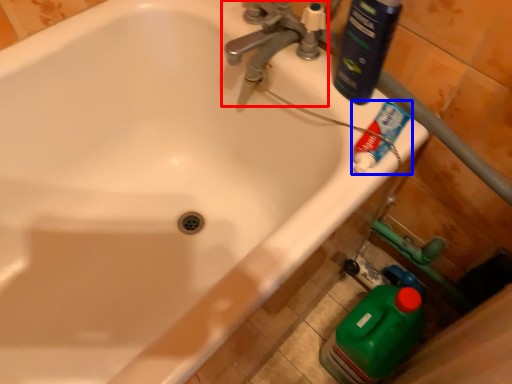
Question: Among these objects, which one is nearest to the camera, tap (highlighted by a red box) or toothpaste (highlighted by a blue box)?

Choices:
 (A) tap
 (B) toothpaste

Answer: (B)